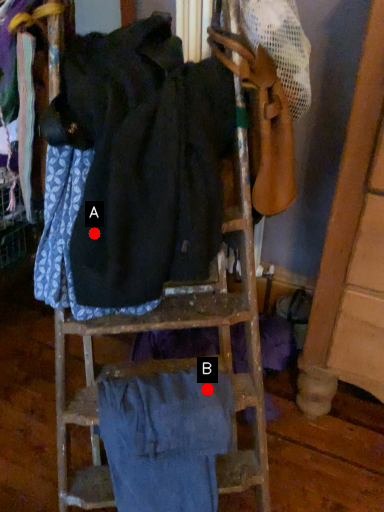
Question: Two points are circled on the image, labeled by A and B beside each circle. Which point is closer to the camera?

Choices:
 (A) A is closer
 (B) B is closer

Answer: (A)